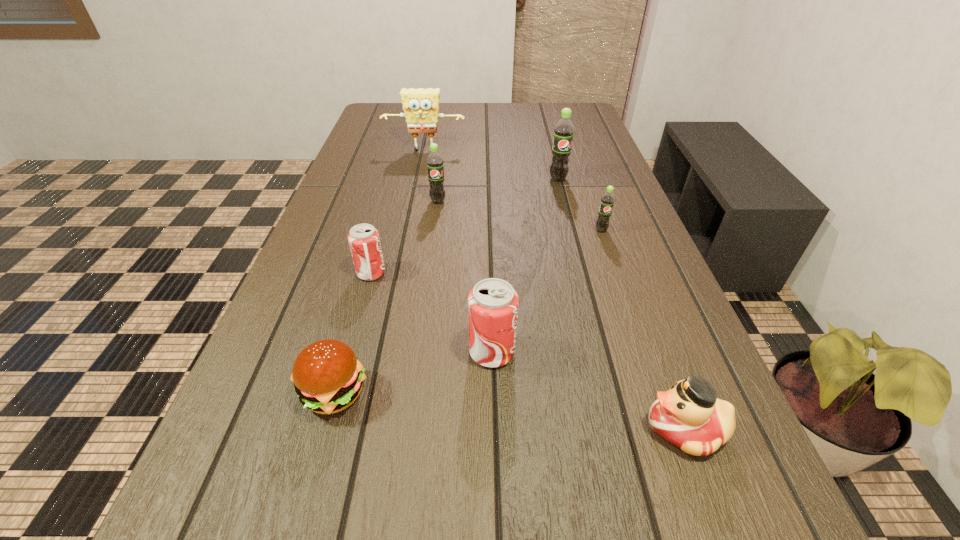
At what (x,y) coordinates should I click in order to perform the action: click on the smallest green soda. Please return your answer as a coordinate pair (x, y). The height and width of the screenshot is (540, 960). Looking at the image, I should click on (607, 201).

Identify the location of the fourth farthest object. The width and height of the screenshot is (960, 540). (607, 201).

I want to click on duck, so click(x=689, y=415).

Where is `hamburger`? hamburger is located at coordinates (327, 376).

Locate an element on the screen. The width and height of the screenshot is (960, 540). vacant region located 0.230m on the front label of the tallest soda is located at coordinates (572, 234).

This screenshot has height=540, width=960. I want to click on vacant space located on the face of the farthest object, so click(421, 168).

The height and width of the screenshot is (540, 960). I want to click on free space located on the front label of the third farthest object, so click(432, 245).

Find the location of a particular element. free space located 0.210m on the front of the nearest soda is located at coordinates (495, 501).

This screenshot has width=960, height=540. I want to click on vacant space situated 0.280m on the back of the leftmost soda, so click(393, 195).

Locate an element on the screen. free spot located 0.070m on the front label of the nearest green soda is located at coordinates point(609,253).